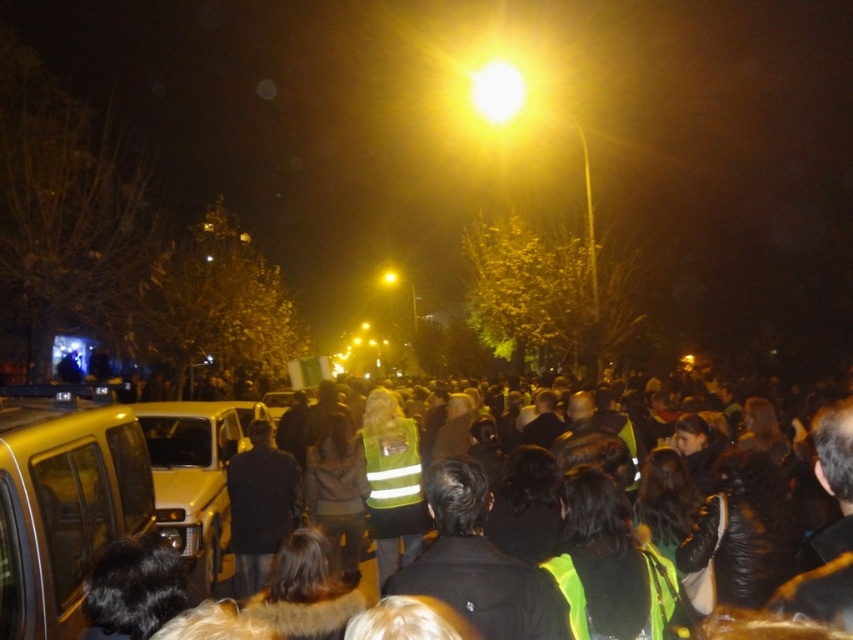
You are a pedestrian trying to cross the street at night. You see a reflective yellow vest at center and a metallic silver car at center. Which object will be more visible to you under the streetlamp?

The reflective yellow vest at center will be more visible because it is smaller in size and its reflective material would catch the light from the streetlamp more effectively than the larger metallic silver car at center.

You are standing at the point labeled as point [62,506] in the image. Looking around, you see a metallic gold taxi at lower left. What is the nearest object to you?

The nearest object to you is the metallic gold taxi at lower left because you are standing at the point which is located on it.